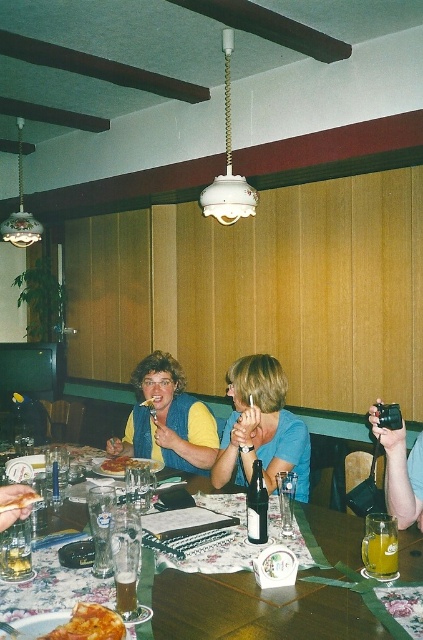
You are a server in this dining area and need to deliver a dessert to the customer wearing the blue denim vest at center. The dessert is currently placed on the translucent glass mug at table center. Can you directly hand the dessert to the customer without moving any items?

The blue denim vest at center is further to the viewer than the translucent glass mug at table center, so the customer wearing the blue denim vest at center is closer to you. Therefore, you can directly hand the dessert to them without moving any items since the dessert is already on the translucent glass mug at table center which is behind the customer.